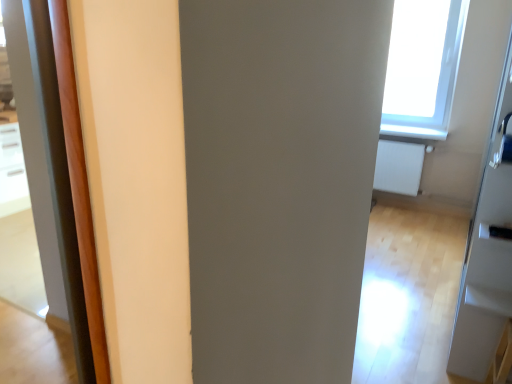
Question: Is white matte radiator at right shorter than transparent glass screen door at upper right?

Choices:
 (A) no
 (B) yes

Answer: (B)

Question: From a real-world perspective, is white matte radiator at right beneath transparent glass screen door at upper right?

Choices:
 (A) yes
 (B) no

Answer: (A)

Question: From the image's perspective, is white matte radiator at right on transparent glass screen door at upper right?

Choices:
 (A) no
 (B) yes

Answer: (B)

Question: Is the position of white matte radiator at right more distant than that of transparent glass screen door at upper right?

Choices:
 (A) yes
 (B) no

Answer: (A)

Question: From a real-world perspective, is white matte radiator at right located higher than transparent glass screen door at upper right?

Choices:
 (A) no
 (B) yes

Answer: (A)

Question: From a real-world perspective, relative to black plastic door handle at lower right, the 1th door handle in the bottom-to-top sequence, is white matte radiator at right vertically above or below?

Choices:
 (A) above
 (B) below

Answer: (B)

Question: Is white matte radiator at right in front of or behind black plastic door handle at lower right, the 1th door handle in the bottom-to-top sequence, in the image?

Choices:
 (A) front
 (B) behind

Answer: (B)

Question: Considering the positions of white matte radiator at right and black plastic door handle at lower right, the 1th door handle in the bottom-to-top sequence, in the image, is white matte radiator at right taller or shorter than black plastic door handle at lower right, the 1th door handle in the bottom-to-top sequence,?

Choices:
 (A) short
 (B) tall

Answer: (B)

Question: Based on their sizes in the image, would you say white matte radiator at right is bigger or smaller than black plastic door handle at lower right, the second door handle viewed from the top?

Choices:
 (A) big
 (B) small

Answer: (A)

Question: Is satin silver door handle at right, the second door handle ordered from the bottom, in front of or behind white matte radiator at right in the image?

Choices:
 (A) front
 (B) behind

Answer: (A)

Question: In terms of size, does satin silver door handle at right, which appears as the 1th door handle when viewed from the top, appear bigger or smaller than white matte radiator at right?

Choices:
 (A) big
 (B) small

Answer: (B)

Question: Is satin silver door handle at right, which appears as the 1th door handle when viewed from the top, to the left or to the right of white matte radiator at right in the image?

Choices:
 (A) left
 (B) right

Answer: (A)

Question: Is satin silver door handle at right, the second door handle ordered from the bottom, spatially inside white matte radiator at right, or outside of it?

Choices:
 (A) outside
 (B) inside

Answer: (A)

Question: From the image's perspective, is satin silver door handle at right, which appears as the 1th door handle when viewed from the top, above or below transparent glass screen door at upper right?

Choices:
 (A) below
 (B) above

Answer: (B)

Question: Considering the positions of satin silver door handle at right, the second door handle ordered from the bottom, and transparent glass screen door at upper right in the image, is satin silver door handle at right, the second door handle ordered from the bottom, bigger or smaller than transparent glass screen door at upper right?

Choices:
 (A) big
 (B) small

Answer: (B)